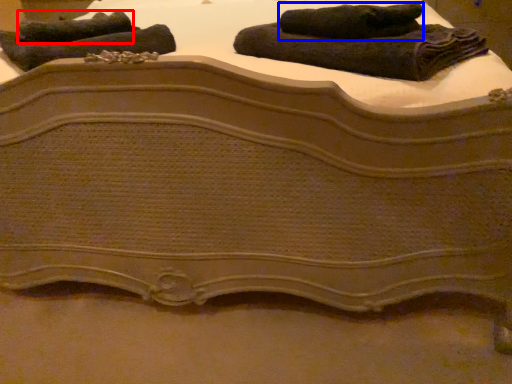
Question: Which object is further to the camera taking this photo, towel (highlighted by a red box) or towel (highlighted by a blue box)?

Choices:
 (A) towel
 (B) towel

Answer: (A)